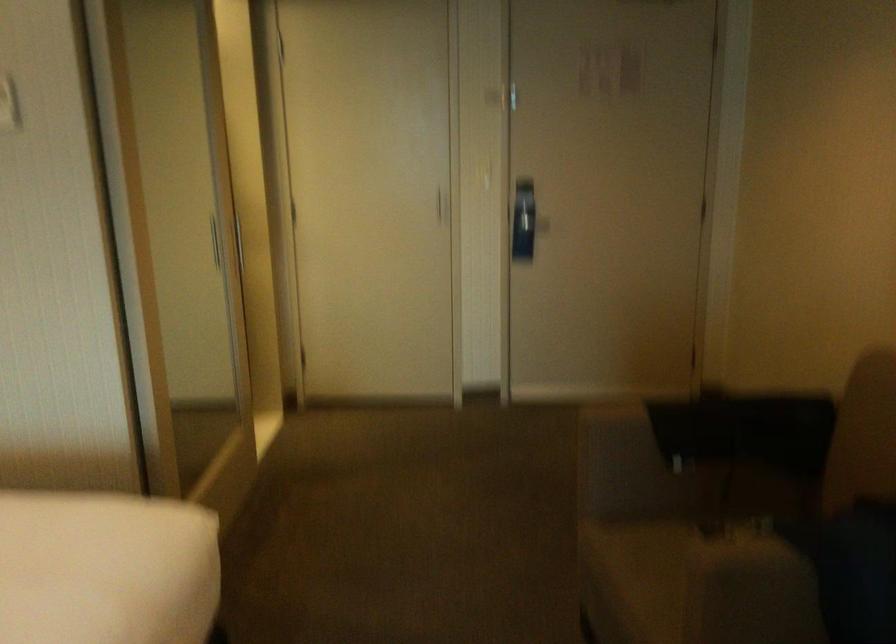
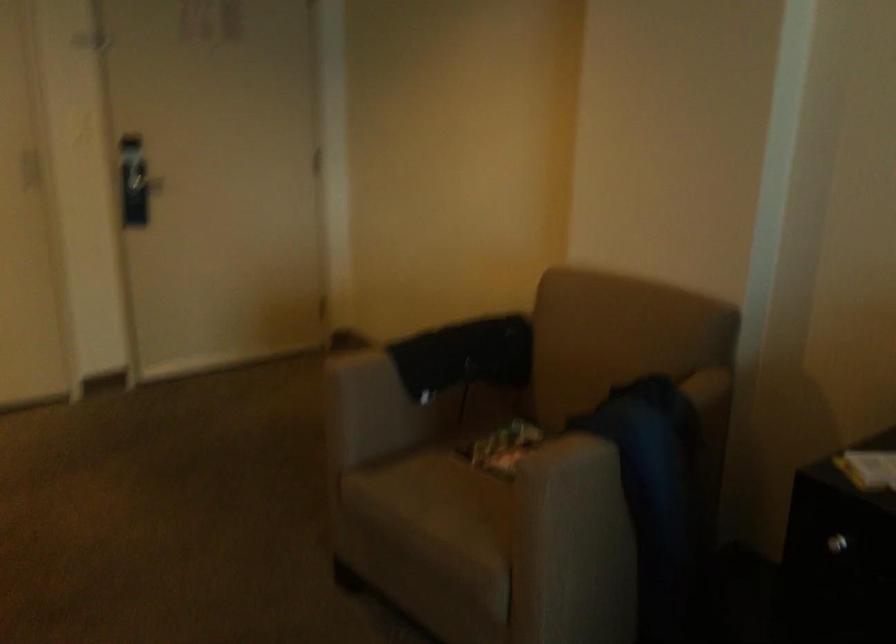
Locate, in the second image, the point that corresponds to (x=789, y=536) in the first image.

(597, 433)